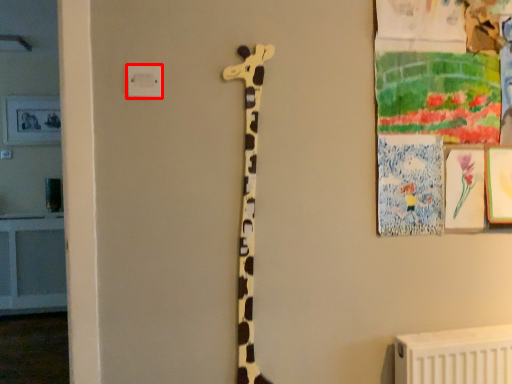
Question: From the image's perspective, what is the correct spatial positioning of electric outlet (annotated by the red box) in reference to giraffe?

Choices:
 (A) below
 (B) above

Answer: (B)